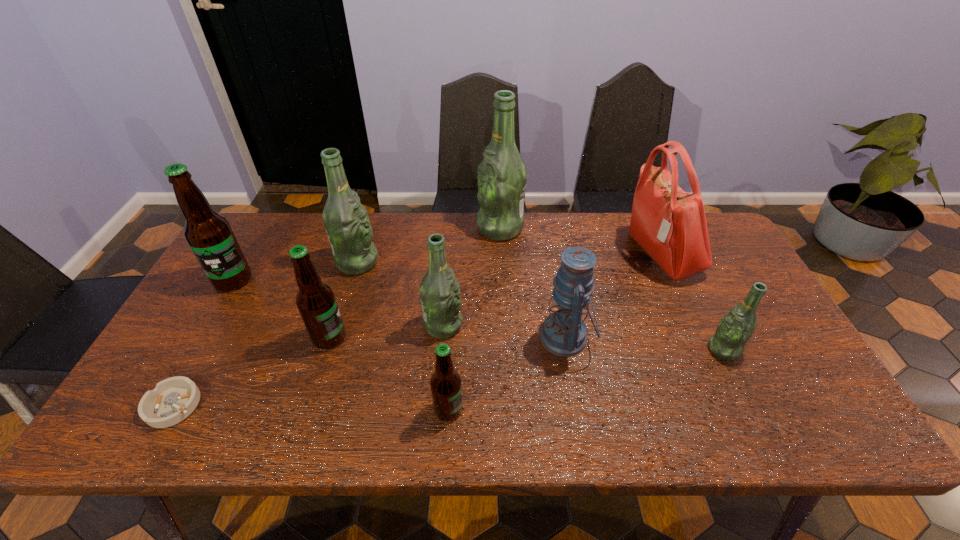
Image resolution: width=960 pixels, height=540 pixels. Identify the location of lantern. (563, 333).

Locate an element on the screen. The image size is (960, 540). the nearest brown beer bottle is located at coordinates (446, 388).

In order to click on the smallest brown beer bottle in this screenshot , I will do `click(446, 388)`.

The height and width of the screenshot is (540, 960). In order to click on the rightmost green beer bottle in this screenshot , I will do coord(736,327).

Where is `the smallest green beer bottle`? Image resolution: width=960 pixels, height=540 pixels. the smallest green beer bottle is located at coordinates (736, 327).

At what (x,y) coordinates should I click in order to perform the action: click on ashtray. Please return your answer as a coordinate pair (x, y). Looking at the image, I should click on (172, 400).

I want to click on vacant space located 0.240m on the surface of the seventh object from left to right, so click(405, 228).

The image size is (960, 540). I want to click on vacant space located 0.340m on the surface of the seventh object from left to right, so click(x=375, y=228).

Where is `vacant space located on the surface of the seventh object from left to right`? The height and width of the screenshot is (540, 960). vacant space located on the surface of the seventh object from left to right is located at coordinates (422, 228).

Locate an element on the screen. The width and height of the screenshot is (960, 540). free space located 0.310m on the front-facing side of the red handbag is located at coordinates (528, 254).